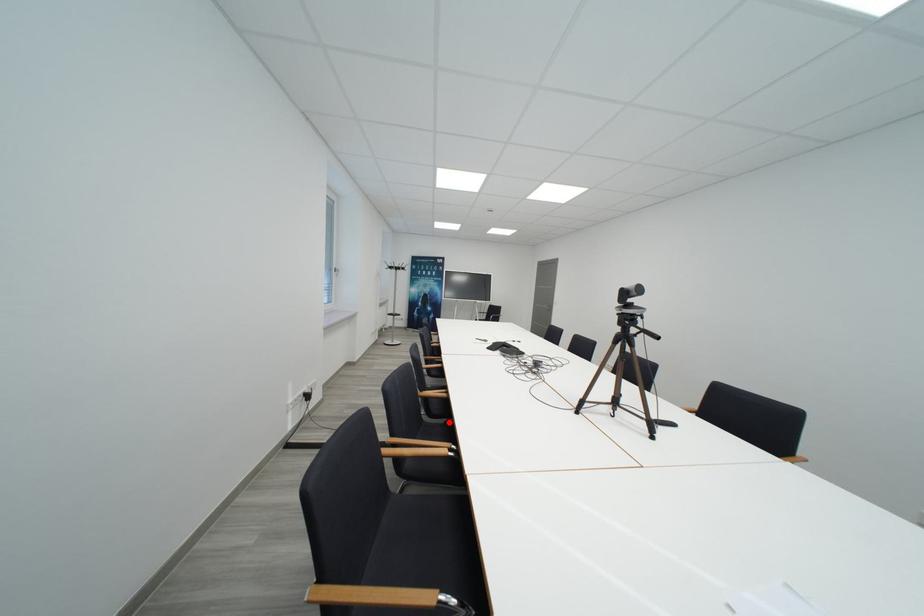
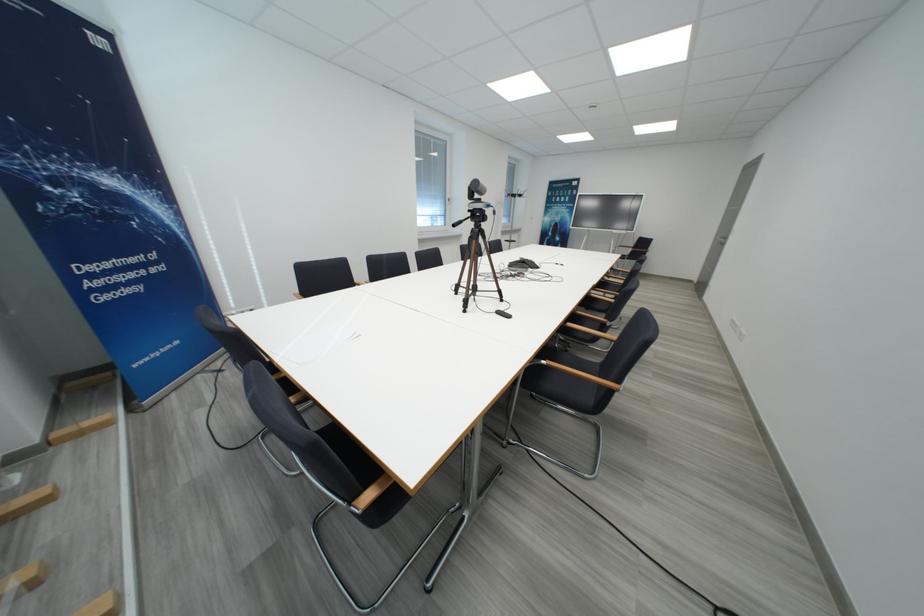
Question: I am providing you with two images of the same scene from different viewpoints. A red point is marked on the first image. Can you still see the location of the red point in image 2?

Choices:
 (A) Yes
 (B) No

Answer: (B)